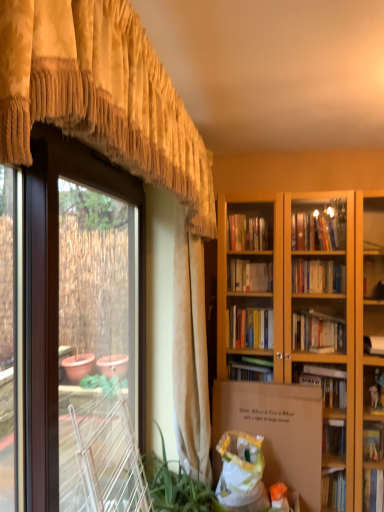
This screenshot has width=384, height=512. What do you see at coordinates (240, 471) in the screenshot? I see `white plastic bag at lower center` at bounding box center [240, 471].

Measure the distance between point (x=192, y=442) and camera.

7.85 feet.

This screenshot has height=512, width=384. What do you see at coordinates (176, 486) in the screenshot?
I see `green leafy plant at lower left` at bounding box center [176, 486].

This screenshot has height=512, width=384. What do you see at coordinates (100, 95) in the screenshot?
I see `gold textured valance at upper left, arranged as the 2th curtain when viewed from the back` at bounding box center [100, 95].

The height and width of the screenshot is (512, 384). In order to click on gold textured valance at upper left, arranged as the 2th curtain when viewed from the back in this screenshot , I will do (x=100, y=95).

You are a GUI agent. You are given a task and a screenshot of the screen. Output one action in this format:
    pyautogui.click(x=<x>, y=<y>)
    Task: Click on the white plastic bag at lower center
    This screenshot has height=512, width=384.
    Given the screenshot: What is the action you would take?
    pyautogui.click(x=240, y=471)

From a real-world perspective, is white plastic bag at lower center below green leafy plant at lower left?

Yes.

Who is more distant, white plastic bag at lower center or green leafy plant at lower left?

Positioned behind is white plastic bag at lower center.

At what (x,y) coordinates should I click in order to perform the action: click on shopping bag on the right of green leafy plant at lower left. Please return your answer as a coordinate pair (x, y). The height and width of the screenshot is (512, 384). Looking at the image, I should click on [x=240, y=471].

Is white plastic bag at lower center facing away from green leafy plant at lower left?

No, white plastic bag at lower center's orientation is not away from green leafy plant at lower left.

Can you confirm if gold textured valance at upper left, the 1th curtain in the front-to-back sequence, is thinner than gold textured valance at center, the 1th curtain positioned from the back?

Incorrect, the width of gold textured valance at upper left, the 1th curtain in the front-to-back sequence, is not less than that of gold textured valance at center, the 1th curtain positioned from the back.

From the picture: Who is taller, gold textured valance at upper left, the 1th curtain in the front-to-back sequence, or gold textured valance at center, which is counted as the second curtain, starting from the front?

gold textured valance at center, which is counted as the second curtain, starting from the front.

Is gold textured valance at center, the 1th curtain positioned from the back, at the back of gold textured valance at upper left, the 1th curtain in the front-to-back sequence?

No, gold textured valance at upper left, the 1th curtain in the front-to-back sequence, is not facing the opposite direction of gold textured valance at center, the 1th curtain positioned from the back.

Based on the photo, considering the relative positions of gold textured valance at upper left, arranged as the 2th curtain when viewed from the back, and gold textured valance at center, which is counted as the second curtain, starting from the front, in the image provided, is gold textured valance at upper left, arranged as the 2th curtain when viewed from the back, to the left of gold textured valance at center, which is counted as the second curtain, starting from the front, from the viewer's perspective?

Yes.

The image size is (384, 512). I want to click on screen door on the left of green leafy plant at lower left, so click(x=57, y=287).

Is green leafy plant at lower left a part of brown matte screen door at left?

Yes, brown matte screen door at left contains green leafy plant at lower left.

Is brown matte screen door at left aimed at green leafy plant at lower left?

Yes, brown matte screen door at left faces towards green leafy plant at lower left.

Looking at this image, is brown matte screen door at left not close to green leafy plant at lower left?

Yes, brown matte screen door at left and green leafy plant at lower left are quite far apart.

Would you consider green leafy plant at lower left to be distant from white plastic bag at lower center?

green leafy plant at lower left is actually quite close to white plastic bag at lower center.

Do you think green leafy plant at lower left is within white plastic bag at lower center, or outside of it?

green leafy plant at lower left is not enclosed by white plastic bag at lower center.

Is green leafy plant at lower left wider or thinner than white plastic bag at lower center?

Clearly, green leafy plant at lower left has more width compared to white plastic bag at lower center.

From the image's perspective, is green leafy plant at lower left located beneath white plastic bag at lower center?

Incorrect, from the image's perspective, green leafy plant at lower left is higher than white plastic bag at lower center.

Is brown matte screen door at left positioned beyond the bounds of gold textured valance at upper left, the 1th curtain in the front-to-back sequence?

Indeed, brown matte screen door at left is completely outside gold textured valance at upper left, the 1th curtain in the front-to-back sequence.

How different are the orientations of brown matte screen door at left and gold textured valance at upper left, arranged as the 2th curtain when viewed from the back, in degrees?

brown matte screen door at left and gold textured valance at upper left, arranged as the 2th curtain when viewed from the back, are facing 2.61 degrees away from each other.

From the image's perspective, between brown matte screen door at left and gold textured valance at upper left, the 1th curtain in the front-to-back sequence, which one is located above?

gold textured valance at upper left, the 1th curtain in the front-to-back sequence, from the image's perspective.

Can you confirm if white cardboard box at center is positioned to the left of white plastic bag at lower center?

No.

In the scene shown: Considering the relative sizes of white cardboard box at center and white plastic bag at lower center in the image provided, is white cardboard box at center shorter than white plastic bag at lower center?

No, white cardboard box at center is not shorter than white plastic bag at lower center.

Would you say white cardboard box at center is outside white plastic bag at lower center?

Yes, white cardboard box at center is located beyond the bounds of white plastic bag at lower center.

Which is correct: gold textured valance at upper left, arranged as the 2th curtain when viewed from the back, is inside green leafy plant at lower left, or outside of it?

gold textured valance at upper left, arranged as the 2th curtain when viewed from the back, lies outside green leafy plant at lower left.

Is the depth of gold textured valance at upper left, the 1th curtain in the front-to-back sequence, greater than that of green leafy plant at lower left?

That is False.

Could you tell me if gold textured valance at upper left, arranged as the 2th curtain when viewed from the back, is facing green leafy plant at lower left?

No, gold textured valance at upper left, arranged as the 2th curtain when viewed from the back, is not turned towards green leafy plant at lower left.

Does point (142, 42) come in front of point (194, 490)?

That is True.

You are a GUI agent. You are given a task and a screenshot of the screen. Output one action in this format:
    pyautogui.click(x=<x>, y=<y>)
    Task: Click on the houseplant on the left side of white plastic bag at lower center
    
    Given the screenshot: What is the action you would take?
    tap(176, 486)

The height and width of the screenshot is (512, 384). I want to click on curtain that appears behind the gold textured valance at upper left, arranged as the 2th curtain when viewed from the back, so click(190, 353).

Looking at the image, which one is located closer to green leafy plant at lower left, white plastic bag at lower center or gold textured valance at center, which is counted as the second curtain, starting from the front?

white plastic bag at lower center is closer to green leafy plant at lower left.

Which object lies further to the anchor point gold textured valance at upper left, arranged as the 2th curtain when viewed from the back, white cardboard box at center or gold textured valance at center, which is counted as the second curtain, starting from the front?

Among the two, white cardboard box at center is located further to gold textured valance at upper left, arranged as the 2th curtain when viewed from the back.

Considering their positions, is brown matte screen door at left positioned further to white cardboard box at center than gold textured valance at upper left, the 1th curtain in the front-to-back sequence?

brown matte screen door at left.

Which object lies nearer to the anchor point gold textured valance at upper left, arranged as the 2th curtain when viewed from the back, brown matte screen door at left or white cardboard box at center?

brown matte screen door at left.

Looking at the image, which one is located further to white cardboard box at center, green leafy plant at lower left or gold textured valance at upper left, arranged as the 2th curtain when viewed from the back?

gold textured valance at upper left, arranged as the 2th curtain when viewed from the back, lies further to white cardboard box at center than the other object.

Based on their spatial positions, is brown matte screen door at left or gold textured valance at center, which is counted as the second curtain, starting from the front, closer to gold textured valance at upper left, arranged as the 2th curtain when viewed from the back?

brown matte screen door at left.

From the image, which object appears to be nearer to gold textured valance at center, which is counted as the second curtain, starting from the front, green leafy plant at lower left or gold textured valance at upper left, the 1th curtain in the front-to-back sequence?

green leafy plant at lower left lies closer to gold textured valance at center, which is counted as the second curtain, starting from the front, than the other object.

Estimate the real-world distances between objects in this image. Which object is closer to green leafy plant at lower left, gold textured valance at center, which is counted as the second curtain, starting from the front, or gold textured valance at upper left, the 1th curtain in the front-to-back sequence?

gold textured valance at center, which is counted as the second curtain, starting from the front, lies closer to green leafy plant at lower left than the other object.

This screenshot has width=384, height=512. Find the location of `shopping bag between brown matte screen door at left and white cardboard box at center from front to back`. shopping bag between brown matte screen door at left and white cardboard box at center from front to back is located at coordinates (240, 471).

You are a GUI agent. You are given a task and a screenshot of the screen. Output one action in this format:
    pyautogui.click(x=<x>, y=<y>)
    Task: Click on the houseplant between gold textured valance at upper left, the 1th curtain in the front-to-back sequence, and white cardboard box at center from front to back
    The image size is (384, 512).
    Given the screenshot: What is the action you would take?
    pyautogui.click(x=176, y=486)

You are a GUI agent. You are given a task and a screenshot of the screen. Output one action in this format:
    pyautogui.click(x=<x>, y=<y>)
    Task: Click on the screen door between gold textured valance at upper left, the 1th curtain in the front-to-back sequence, and white plastic bag at lower center, along the z-axis
    
    Given the screenshot: What is the action you would take?
    pyautogui.click(x=57, y=287)

I want to click on shopping bag between gold textured valance at upper left, the 1th curtain in the front-to-back sequence, and white cardboard box at center, along the z-axis, so click(x=240, y=471).